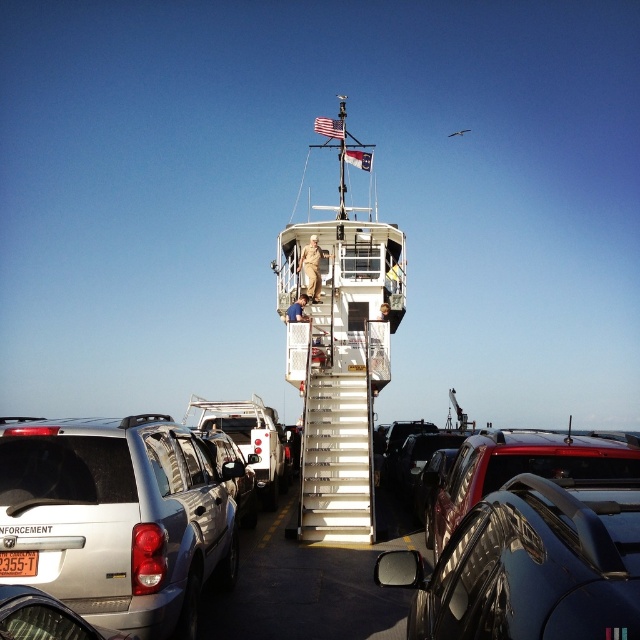
Question: Where is silver metallic suv at lower left located in relation to shiny black truck at lower right in the image?

Choices:
 (A) above
 (B) below

Answer: (B)

Question: Can you confirm if shiny black truck at lower right is wider than silver metallic car at lower left?

Choices:
 (A) no
 (B) yes

Answer: (B)

Question: Which of the following is the closest to the observer?

Choices:
 (A) (317, 486)
 (B) (474, 452)
 (C) (10, 576)
 (D) (204, 451)

Answer: (C)

Question: Which point is farther to the camera?

Choices:
 (A) shiny black truck at lower right
 (B) white metallic boat at center
 (C) glossy black car at lower right

Answer: (B)

Question: Considering the relative positions of shiny black truck at lower right and silver metallic car at lower left in the image provided, where is shiny black truck at lower right located with respect to silver metallic car at lower left?

Choices:
 (A) right
 (B) left

Answer: (A)

Question: Which point is farther to the camera?

Choices:
 (A) (524, 580)
 (B) (324, 244)
 (C) (17, 605)
 (D) (557, 464)

Answer: (B)